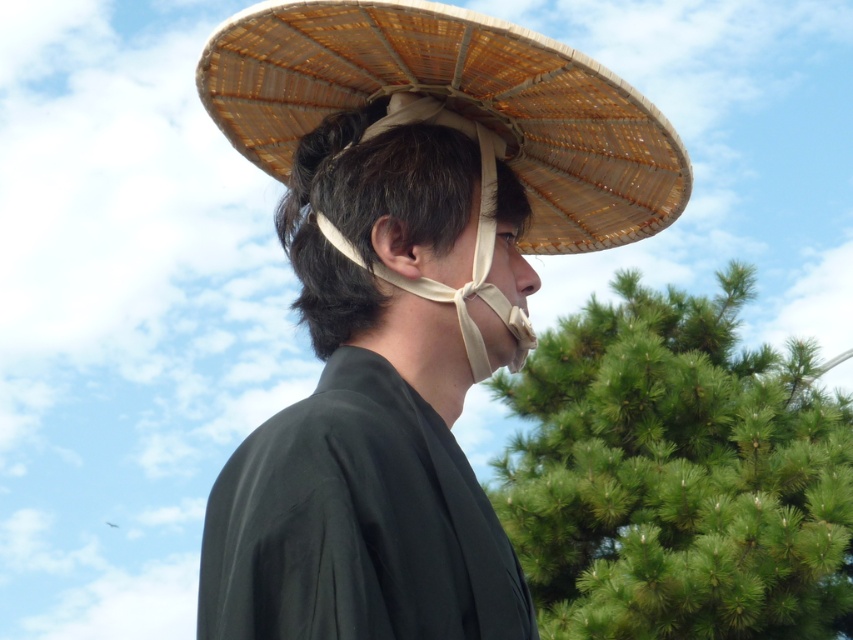
Question: Does black silk kimono at center have a greater width compared to brown woven straw hat at upper center?

Choices:
 (A) no
 (B) yes

Answer: (A)

Question: Among these points, which one is farthest from the camera?

Choices:
 (A) (386, 422)
 (B) (561, 321)
 (C) (572, 134)
 (D) (343, 147)

Answer: (B)

Question: Based on their relative distances, which object is farther from the black silk kimono at center?

Choices:
 (A) green needle-like leaves at right
 (B) brown woven straw hat at upper center

Answer: (A)

Question: Can you confirm if green needle-like leaves at right is smaller than brown woven straw hat at upper center?

Choices:
 (A) no
 (B) yes

Answer: (A)

Question: Is brown woven straw hat at upper center above bamboo straw hat at center?

Choices:
 (A) yes
 (B) no

Answer: (A)

Question: Which object is farther from the camera taking this photo?

Choices:
 (A) green needle-like leaves at right
 (B) brown woven straw hat at upper center
 (C) black silk kimono at center

Answer: (A)